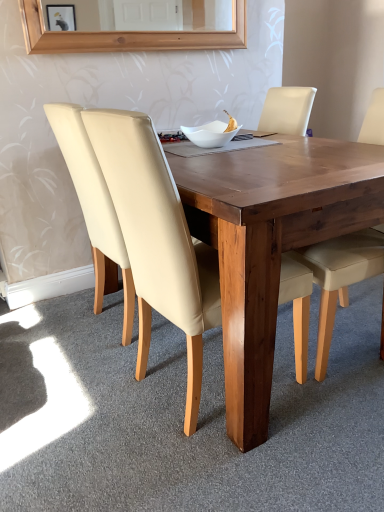
Describe the element at coordinates (344, 263) in the screenshot. I see `beige leather chair at center, which appears as the first chair when viewed from the right` at that location.

Where is `beige leather chair at left, placed as the third chair when sorted from right to left`? The height and width of the screenshot is (512, 384). beige leather chair at left, placed as the third chair when sorted from right to left is located at coordinates (94, 207).

Locate an element on the screen. beige leather chair at left, which appears as the second chair when viewed from the left is located at coordinates (157, 240).

The height and width of the screenshot is (512, 384). I want to click on white glossy bowl at center, so click(210, 134).

The width and height of the screenshot is (384, 512). Describe the element at coordinates (210, 134) in the screenshot. I see `white glossy bowl at center` at that location.

What is the approximate width of wooden table at center?

It is 1.42 meters.

Where is `beige leather chair at center, which appears as the first chair when viewed from the right`? This screenshot has height=512, width=384. beige leather chair at center, which appears as the first chair when viewed from the right is located at coordinates (344, 263).

From the image's perspective, is beige leather chair at left, which appears as the second chair when viewed from the right, above or below wooden table at center?

Clearly, from the image's perspective, beige leather chair at left, which appears as the second chair when viewed from the right, is below wooden table at center.

Considering the sizes of objects beige leather chair at left, which appears as the second chair when viewed from the right, and wooden table at center in the image provided, who is smaller, beige leather chair at left, which appears as the second chair when viewed from the right, or wooden table at center?

beige leather chair at left, which appears as the second chair when viewed from the right, is smaller.

Is beige leather chair at left, which appears as the second chair when viewed from the left, in front of or behind wooden table at center in the image?

In the image, beige leather chair at left, which appears as the second chair when viewed from the left, appears in front of wooden table at center.

Is beige leather chair at left, which appears as the second chair when viewed from the left, far away from wooden table at center?

Actually, beige leather chair at left, which appears as the second chair when viewed from the left, and wooden table at center are a little close together.

Considering the relative positions of beige leather chair at center, which is the third chair from left to right, and beige leather chair at left, placed as the third chair when sorted from right to left, in the image provided, is beige leather chair at center, which is the third chair from left to right, in front of beige leather chair at left, placed as the third chair when sorted from right to left,?

Yes.

Is beige leather chair at center, which is the third chair from left to right, not within beige leather chair at left, the first chair positioned from the left?

That's correct, beige leather chair at center, which is the third chair from left to right, is outside of beige leather chair at left, the first chair positioned from the left.

Does beige leather chair at center, which is the third chair from left to right, appear on the left side of beige leather chair at left, the first chair positioned from the left?

Incorrect, beige leather chair at center, which is the third chair from left to right, is not on the left side of beige leather chair at left, the first chair positioned from the left.

Considering the points (326, 260) and (224, 139), which point is in front, point (326, 260) or point (224, 139)?

The point (326, 260) is in front.

From the image's perspective, is beige leather chair at center, which is the third chair from left to right, on top of white glossy bowl at center?

No, from the image's perspective, beige leather chair at center, which is the third chair from left to right, is not above white glossy bowl at center.

Based on the photo, can you confirm if beige leather chair at center, which appears as the first chair when viewed from the right, is thinner than white glossy bowl at center?

Incorrect, the width of beige leather chair at center, which appears as the first chair when viewed from the right, is not less than that of white glossy bowl at center.

Considering the positions of objects beige leather chair at center, which appears as the first chair when viewed from the right, and white glossy bowl at center in the image provided, who is in front, beige leather chair at center, which appears as the first chair when viewed from the right, or white glossy bowl at center?

beige leather chair at center, which appears as the first chair when viewed from the right, is more forward.

Is beige leather chair at left, the first chair positioned from the left, wider or thinner than beige leather chair at center, which appears as the first chair when viewed from the right?

beige leather chair at left, the first chair positioned from the left, is thinner than beige leather chair at center, which appears as the first chair when viewed from the right.

Is beige leather chair at left, placed as the third chair when sorted from right to left, oriented away from beige leather chair at center, which is the third chair from left to right?

No, beige leather chair at left, placed as the third chair when sorted from right to left, is not facing away from beige leather chair at center, which is the third chair from left to right.

What's the angular difference between beige leather chair at left, placed as the third chair when sorted from right to left, and beige leather chair at center, which is the third chair from left to right,'s facing directions?

171 degrees separate the facing orientations of beige leather chair at left, placed as the third chair when sorted from right to left, and beige leather chair at center, which is the third chair from left to right.

The width and height of the screenshot is (384, 512). I want to click on chair that is the 2nd object directly below the beige leather chair at left, placed as the third chair when sorted from right to left (from a real-world perspective), so (344, 263).

In the image, is wooden table at center on the left side or the right side of white glossy bowl at center?

wooden table at center is to the right of white glossy bowl at center.

Is wooden table at center positioned behind white glossy bowl at center?

No, wooden table at center is in front of white glossy bowl at center.

Choose the correct answer: Is wooden table at center inside white glossy bowl at center or outside it?

The correct answer is: outside.

From their relative heights in the image, would you say wooden table at center is taller or shorter than white glossy bowl at center?

wooden table at center is taller than white glossy bowl at center.

Could beige leather chair at center, which appears as the first chair when viewed from the right, be considered to be inside wooden table at center?

Yes, beige leather chair at center, which appears as the first chair when viewed from the right, is inside wooden table at center.

Does wooden table at center touch beige leather chair at center, which appears as the first chair when viewed from the right?

They are not placed beside each other.

Considering the points (258, 408) and (366, 272), which point is in front, point (258, 408) or point (366, 272)?

Point (258, 408)

Based on the photo, how far apart are wooden table at center and beige leather chair at center, which is the third chair from left to right?

A distance of 14.74 inches exists between wooden table at center and beige leather chair at center, which is the third chair from left to right.

Is beige leather chair at left, placed as the third chair when sorted from right to left, taller or shorter than wooden table at center?

Considering their sizes, beige leather chair at left, placed as the third chair when sorted from right to left, has more height than wooden table at center.

Is beige leather chair at left, placed as the third chair when sorted from right to left, aimed at wooden table at center?

Yes.

Does beige leather chair at left, the first chair positioned from the left, appear on the left side of wooden table at center?

Yes.

This screenshot has height=512, width=384. Find the location of `round table above the beige leather chair at left, which appears as the second chair when viewed from the right (from the image's perspective)`. round table above the beige leather chair at left, which appears as the second chair when viewed from the right (from the image's perspective) is located at coordinates (270, 243).

At what (x,y) coordinates should I click in order to perform the action: click on chair that is the 2nd one above the beige leather chair at center, which is the third chair from left to right (from a real-world perspective). Please return your answer as a coordinate pair (x, y). Looking at the image, I should click on (94, 207).

Which object lies further to the anchor point white glossy bowl at center, wooden table at center or beige leather chair at center, which is the third chair from left to right?

beige leather chair at center, which is the third chair from left to right, is positioned further to the anchor white glossy bowl at center.

Estimate the real-world distances between objects in this image. Which object is further from beige leather chair at left, placed as the third chair when sorted from right to left, wooden table at center or white glossy bowl at center?

wooden table at center.

When comparing their distances from beige leather chair at left, which appears as the second chair when viewed from the left, does white glossy bowl at center or beige leather chair at center, which appears as the first chair when viewed from the right, seem closer?

beige leather chair at center, which appears as the first chair when viewed from the right, is closer to beige leather chair at left, which appears as the second chair when viewed from the left.

Which object lies further to the anchor point white glossy bowl at center, beige leather chair at left, which appears as the second chair when viewed from the right, or wooden table at center?

beige leather chair at left, which appears as the second chair when viewed from the right, is positioned further to the anchor white glossy bowl at center.

Estimate the real-world distances between objects in this image. Which object is further from beige leather chair at left, which appears as the second chair when viewed from the right, white glossy bowl at center or beige leather chair at left, the first chair positioned from the left?

white glossy bowl at center.

Estimate the real-world distances between objects in this image. Which object is further from beige leather chair at center, which is the third chair from left to right, wooden table at center or beige leather chair at left, which appears as the second chair when viewed from the right?

Based on the image, beige leather chair at left, which appears as the second chair when viewed from the right, appears to be further to beige leather chair at center, which is the third chair from left to right.

From the picture: Looking at the image, which one is located closer to white glossy bowl at center, beige leather chair at center, which appears as the first chair when viewed from the right, or wooden table at center?

Among the two, wooden table at center is located nearer to white glossy bowl at center.

Which object lies nearer to the anchor point beige leather chair at left, which appears as the second chair when viewed from the left, beige leather chair at left, the first chair positioned from the left, or wooden table at center?

Based on the image, wooden table at center appears to be nearer to beige leather chair at left, which appears as the second chair when viewed from the left.

Image resolution: width=384 pixels, height=512 pixels. Find the location of `round table between beige leather chair at left, the first chair positioned from the left, and beige leather chair at center, which is the third chair from left to right`. round table between beige leather chair at left, the first chair positioned from the left, and beige leather chair at center, which is the third chair from left to right is located at coordinates (270, 243).

Locate an element on the screen. round table between beige leather chair at left, which appears as the second chair when viewed from the left, and white glossy bowl at center from front to back is located at coordinates (270, 243).

Identify the location of bowl between beige leather chair at left, the first chair positioned from the left, and beige leather chair at center, which appears as the first chair when viewed from the right, from left to right. (210, 134).

I want to click on chair between beige leather chair at left, the first chair positioned from the left, and beige leather chair at center, which is the third chair from left to right, from left to right, so click(x=157, y=240).